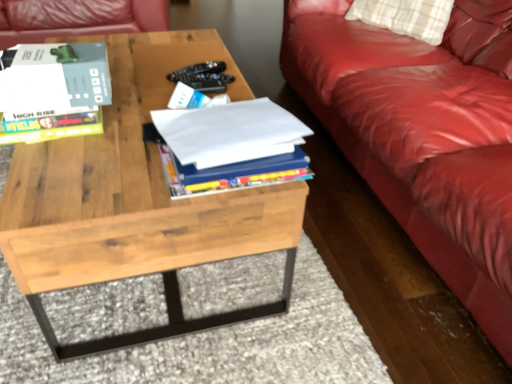
Question: Does white paper at center, marked as the 1th book in a right-to-left arrangement, contain natural wood coffee table at center?

Choices:
 (A) yes
 (B) no

Answer: (B)

Question: From a real-world perspective, is white paper at center, marked as the 2th book in a left-to-right arrangement, over natural wood coffee table at center?

Choices:
 (A) no
 (B) yes

Answer: (B)

Question: Can you confirm if white paper at center, marked as the 1th book in a right-to-left arrangement, is bigger than natural wood coffee table at center?

Choices:
 (A) yes
 (B) no

Answer: (B)

Question: Is there a large distance between white paper at center, marked as the 2th book in a left-to-right arrangement, and natural wood coffee table at center?

Choices:
 (A) yes
 (B) no

Answer: (B)

Question: Is white paper at center, marked as the 1th book in a right-to-left arrangement, facing away from natural wood coffee table at center?

Choices:
 (A) no
 (B) yes

Answer: (A)

Question: Is matte gray book at upper left, which appears as the 2th book when viewed from the right, to the left or to the right of white paper at center, marked as the 2th book in a left-to-right arrangement, in the image?

Choices:
 (A) left
 (B) right

Answer: (A)

Question: Considering their positions, is matte gray book at upper left, arranged as the first book when viewed from the left, located in front of or behind white paper at center, marked as the 2th book in a left-to-right arrangement?

Choices:
 (A) front
 (B) behind

Answer: (B)

Question: From a real-world perspective, relative to white paper at center, marked as the 1th book in a right-to-left arrangement, is matte gray book at upper left, which appears as the 2th book when viewed from the right, vertically above or below?

Choices:
 (A) above
 (B) below

Answer: (A)

Question: Considering the positions of matte gray book at upper left, arranged as the first book when viewed from the left, and white paper at center, marked as the 1th book in a right-to-left arrangement, in the image, is matte gray book at upper left, arranged as the first book when viewed from the left, taller or shorter than white paper at center, marked as the 1th book in a right-to-left arrangement,?

Choices:
 (A) tall
 (B) short

Answer: (A)

Question: Is natural wood coffee table at center taller or shorter than matte gray book at upper left, arranged as the first book when viewed from the left?

Choices:
 (A) short
 (B) tall

Answer: (B)

Question: From a real-world perspective, is natural wood coffee table at center above or below matte gray book at upper left, arranged as the first book when viewed from the left?

Choices:
 (A) above
 (B) below

Answer: (B)

Question: Is point (35, 168) closer or farther from the camera than point (83, 52)?

Choices:
 (A) farther
 (B) closer

Answer: (B)

Question: Is natural wood coffee table at center bigger or smaller than matte gray book at upper left, which appears as the 2th book when viewed from the right?

Choices:
 (A) big
 (B) small

Answer: (A)

Question: Considering the positions of white paper at center, marked as the 1th book in a right-to-left arrangement, and natural wood coffee table at center in the image, is white paper at center, marked as the 1th book in a right-to-left arrangement, taller or shorter than natural wood coffee table at center?

Choices:
 (A) short
 (B) tall

Answer: (A)

Question: Considering the positions of white paper at center, marked as the 2th book in a left-to-right arrangement, and natural wood coffee table at center in the image, is white paper at center, marked as the 2th book in a left-to-right arrangement, wider or thinner than natural wood coffee table at center?

Choices:
 (A) wide
 (B) thin

Answer: (B)